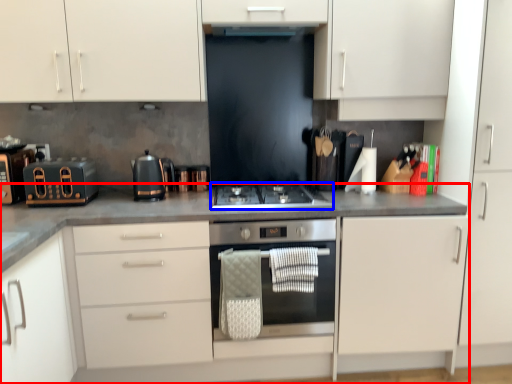
Question: Among these objects, which one is farthest to the camera, countertop (highlighted by a red box) or gas stove (highlighted by a blue box)?

Choices:
 (A) countertop
 (B) gas stove

Answer: (B)